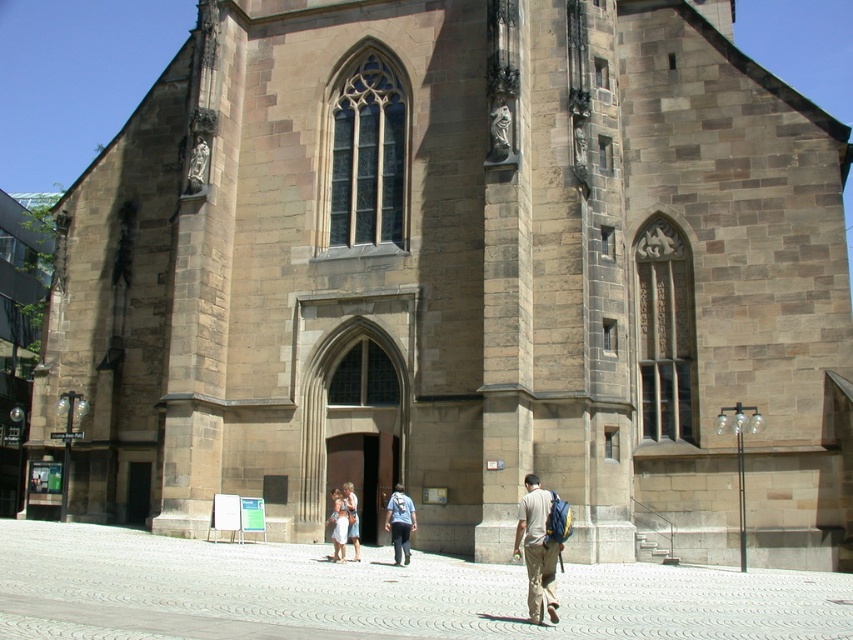
Who is positioned more to the left, light brown canvas backpack at lower right or white cotton dress at center?

Positioned to the left is white cotton dress at center.

Which is below, light brown canvas backpack at lower right or white cotton dress at center?

white cotton dress at center is lower down.

Which is in front, point (523, 525) or point (344, 550)?

Point (523, 525) is in front.

Where is `light brown canvas backpack at lower right`? This screenshot has width=853, height=640. light brown canvas backpack at lower right is located at coordinates (537, 550).

How much distance is there between light brown canvas backpack at lower right and light blue denim jeans at center?

The distance of light brown canvas backpack at lower right from light blue denim jeans at center is 34.34 feet.

Is light brown canvas backpack at lower right taller than light blue denim jeans at center?

Yes.

Locate an element on the screen. Image resolution: width=853 pixels, height=640 pixels. light brown canvas backpack at lower right is located at coordinates (537, 550).

Is white cotton dress at center wider than light blue denim jeans at center?

Yes, white cotton dress at center is wider than light blue denim jeans at center.

Can you confirm if white cotton dress at center is positioned below light blue denim jeans at center?

Yes.

Is point (343, 502) positioned before point (357, 561)?

No.

The height and width of the screenshot is (640, 853). In order to click on white cotton dress at center in this screenshot , I will do `click(338, 524)`.